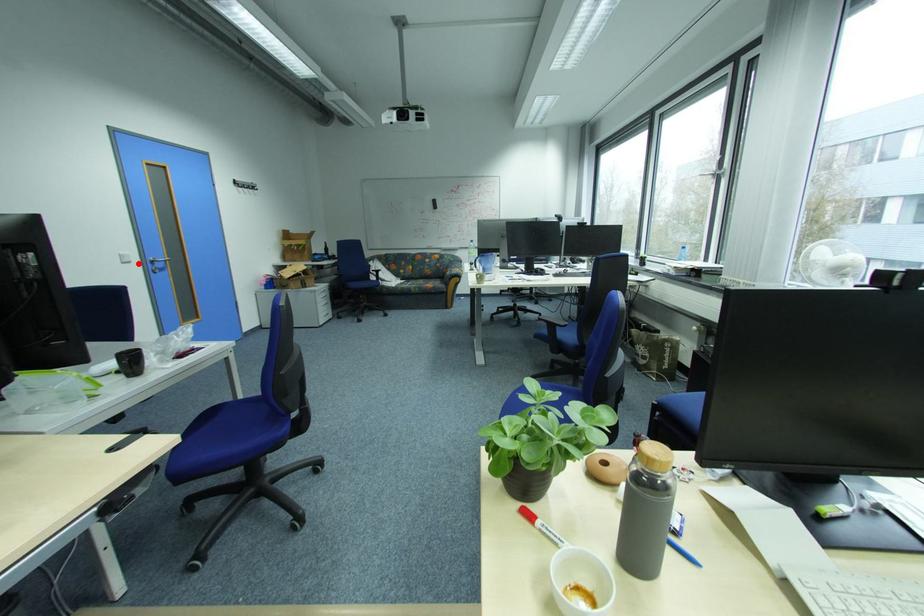
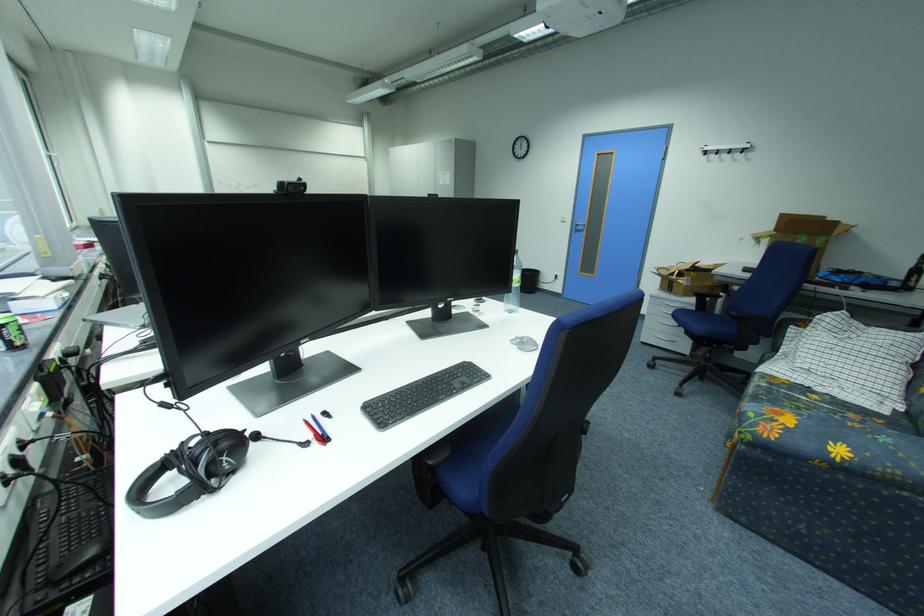
Locate, in the second image, the point that corresponds to the highlighted location in the first image.

(574, 223)